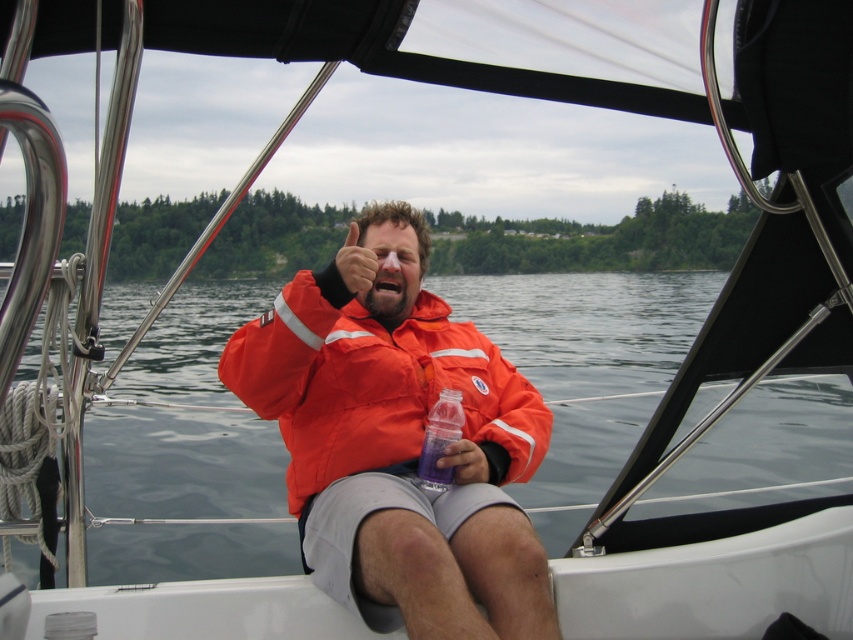
Image resolution: width=853 pixels, height=640 pixels. What do you see at coordinates (398, 442) in the screenshot?
I see `orange fabric jacket at center` at bounding box center [398, 442].

Does orange fabric jacket at center come in front of translucent purple bottle at center?

Yes, orange fabric jacket at center is closer to the viewer.

At what (x,y) coordinates should I click in order to perform the action: click on orange fabric jacket at center. Please return your answer as a coordinate pair (x, y). The image size is (853, 640). Looking at the image, I should click on (398, 442).